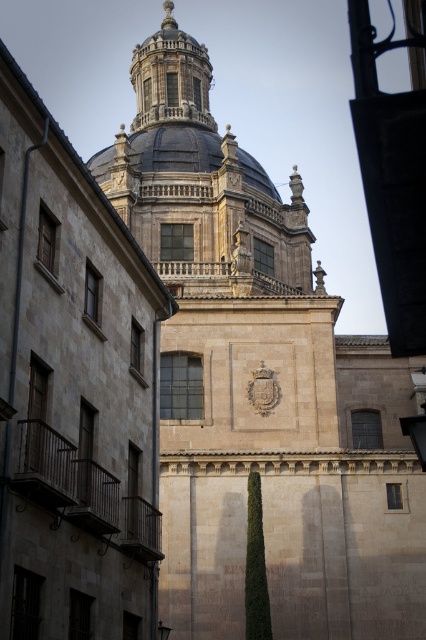
Question: Which point is closer to the camera?

Choices:
 (A) (167, 45)
 (B) (100, 163)

Answer: (B)

Question: Is blue stone dome at center above smooth gray dome at center?

Choices:
 (A) yes
 (B) no

Answer: (A)

Question: Does blue stone dome at center have a greater width compared to smooth gray dome at center?

Choices:
 (A) no
 (B) yes

Answer: (A)

Question: Is blue stone dome at center bigger than smooth gray dome at center?

Choices:
 (A) yes
 (B) no

Answer: (A)